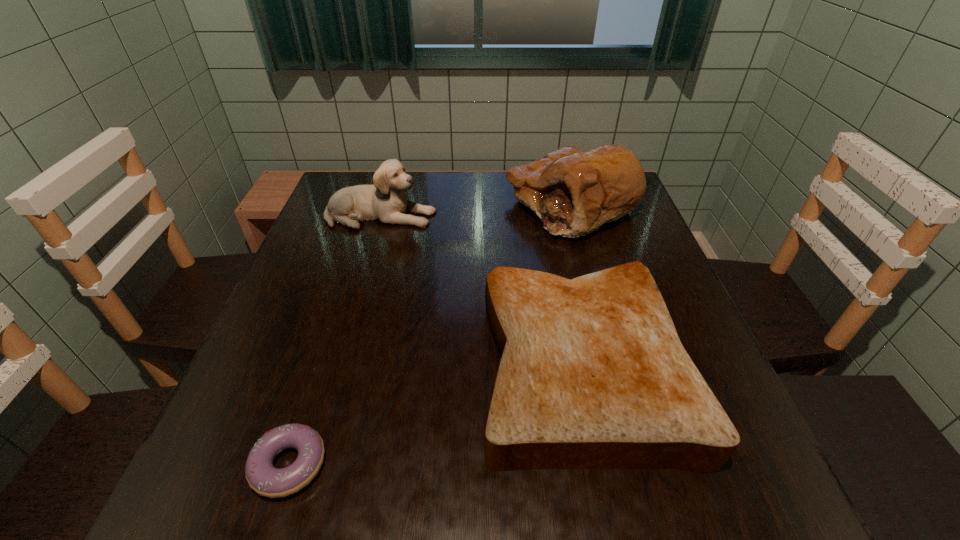
Identify the location of object positioned at the far right corner. tap(573, 192).

Locate an element on the screen. This screenshot has height=540, width=960. object that is at the near right corner is located at coordinates (593, 374).

Locate an element on the screen. free region at the far edge of the desktop is located at coordinates (501, 201).

Where is `vacant space at the near edge of the desktop`? Image resolution: width=960 pixels, height=540 pixels. vacant space at the near edge of the desktop is located at coordinates (491, 498).

In the image, there is a desktop. At what (x,y) coordinates should I click in order to perform the action: click on blank space at the left edge. Please return your answer as a coordinate pair (x, y). Looking at the image, I should click on (364, 237).

At what (x,y) coordinates should I click in order to perform the action: click on vacant space that is in between the shorter bread and the puppy. Please return your answer as a coordinate pair (x, y). Image resolution: width=960 pixels, height=540 pixels. Looking at the image, I should click on (481, 289).

You are a GUI agent. You are given a task and a screenshot of the screen. Output one action in this format:
    pyautogui.click(x=<x>, y=<y>)
    Task: Click on the free space between the second shortest object and the shortest object
    
    Given the screenshot: What is the action you would take?
    pyautogui.click(x=436, y=414)

The height and width of the screenshot is (540, 960). I want to click on empty space between the puppy and the tallest object, so click(x=476, y=211).

The width and height of the screenshot is (960, 540). I want to click on empty space between the shortest object and the third shortest object, so click(x=335, y=340).

The image size is (960, 540). Find the location of `free space that is in between the shortest object and the taller bread`. free space that is in between the shortest object and the taller bread is located at coordinates (430, 335).